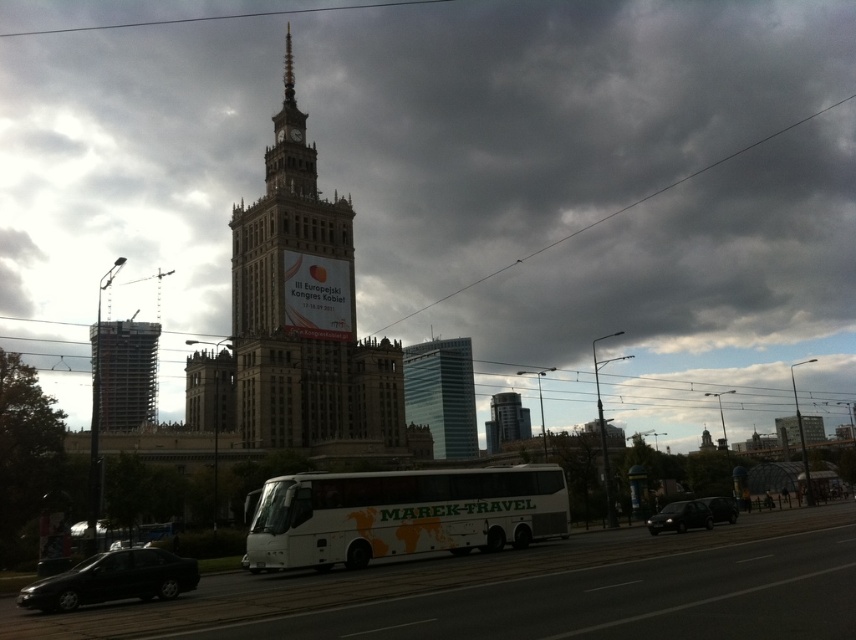
Looking at this image, you are a pedestrian standing at the crosswalk in front of the historic building. You need to cross the street to reach the clock tower. Which vehicle, the white matte bus at center or the shiny black sedan at lower left, is closer to you as you prepare to cross?

The white matte bus at center is closer to you because it is further to the viewer than the shiny black sedan at lower left, meaning it is positioned nearer in the scene.

Based on the photo, you are a tour guide standing on the sidewalk near the white matte bus at center. You want to show tourists the height comparison between the bus and the metallic glass building at left. Which one is taller?

The metallic glass building at left is taller than the white matte bus at center.